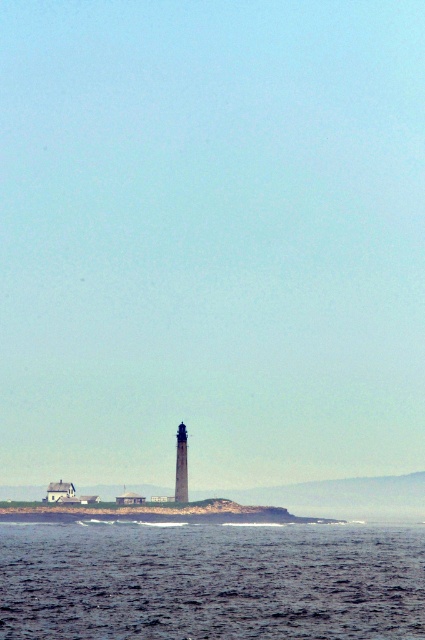
You are a drone operator who needs to fly a drone from the dark blue water at lower center to the smooth gray tower at center. What is the minimum distance the drone must travel?

The minimum distance the drone must travel is 97.60 meters between dark blue water at lower center and smooth gray tower at center.

You are standing on a boat looking at the scene. You see the dark blue water at lower center and the smooth gray tower at center. Which object appears taller from your viewpoint?

The dark blue water at lower center appears taller than the smooth gray tower at center according to the description.